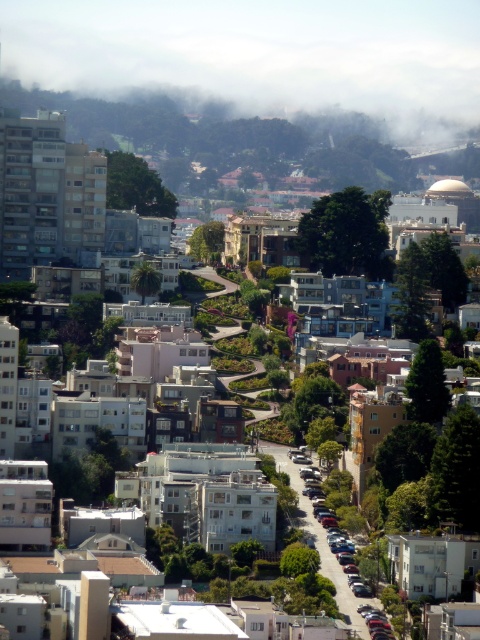
Does foggy cloud at upper center have a lesser width compared to metallic silver car at center-right?

Incorrect, foggy cloud at upper center's width is not less than metallic silver car at center-right's.

Which is more to the right, foggy cloud at upper center or metallic silver car at center-right?

From the viewer's perspective, metallic silver car at center-right appears more on the right side.

Describe the element at coordinates (261, 54) in the screenshot. Image resolution: width=480 pixels, height=640 pixels. I see `foggy cloud at upper center` at that location.

Locate an element on the screen. The height and width of the screenshot is (640, 480). foggy cloud at upper center is located at coordinates (261, 54).